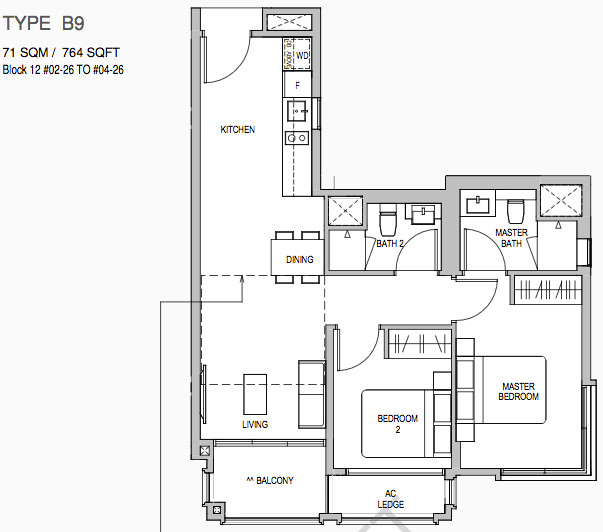
The image size is (603, 532). What are the coordinates of `bath2` in the screenshot? It's located at (386, 243).